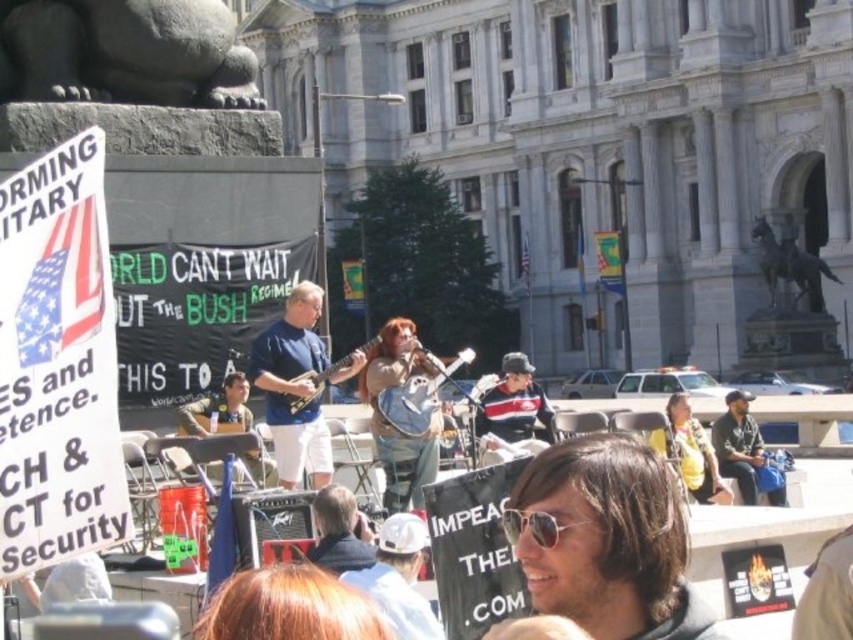
Question: Which is farther from the matte black guitar at center?

Choices:
 (A) striped knit sweater at center
 (B) sunglasses at center
 (C) blue fabric guitar at center
 (D) matte white guitar at center

Answer: (B)

Question: Which point is closer to the camera?

Choices:
 (A) (299, 401)
 (B) (387, 536)
 (C) (430, 410)
 (D) (749, 472)

Answer: (B)

Question: Which object is positioned farthest from the white matte baseball cap at center?

Choices:
 (A) blue fabric guitar at center
 (B) matte white guitar at center
 (C) striped knit sweater at center

Answer: (B)

Question: Is sunglasses at center to the left of black fabric cap at right from the viewer's perspective?

Choices:
 (A) no
 (B) yes

Answer: (B)

Question: Is black fabric cap at right to the right of matte white guitar at center from the viewer's perspective?

Choices:
 (A) no
 (B) yes

Answer: (B)

Question: From the image, what is the correct spatial relationship of white matte baseball cap at center in relation to black fabric cap at right?

Choices:
 (A) right
 (B) left

Answer: (B)